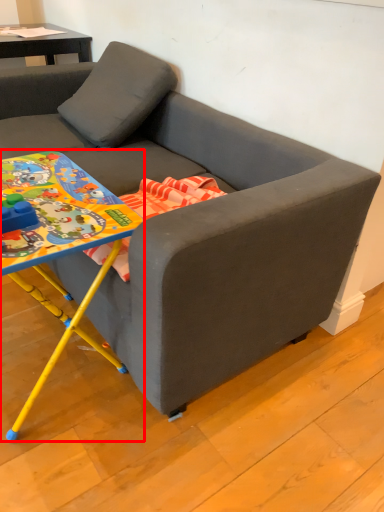
Question: Considering the relative positions of table (annotated by the red box) and studio couch in the image provided, where is table (annotated by the red box) located with respect to the staircase?

Choices:
 (A) left
 (B) right

Answer: (A)